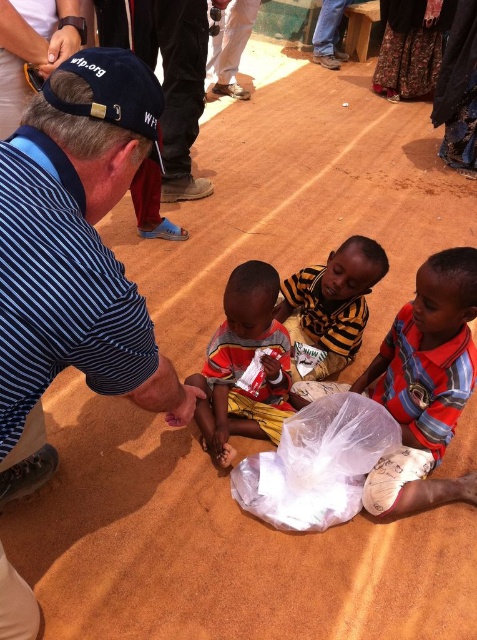
Question: Which point is farther to the camera?

Choices:
 (A) (138, 115)
 (B) (435, 288)

Answer: (B)

Question: Which object is positioned farthest from the striped fabric shirt at lower right?

Choices:
 (A) pink matte hand at lower center
 (B) striped fabric shirt at center
 (C) blue fabric cap at upper left

Answer: (C)

Question: Does striped fabric shirt at center appear under pink matte hand at lower center?

Choices:
 (A) no
 (B) yes

Answer: (A)

Question: Does blue striped shirt at center appear under yellow/black striped shirt at center?

Choices:
 (A) no
 (B) yes

Answer: (A)

Question: Which object is the farthest from the blue striped shirt at center?

Choices:
 (A) striped fabric shirt at center
 (B) yellow/black striped shirt at center

Answer: (B)

Question: Is blue striped shirt at center to the left of pink matte hand at lower center from the viewer's perspective?

Choices:
 (A) no
 (B) yes

Answer: (B)